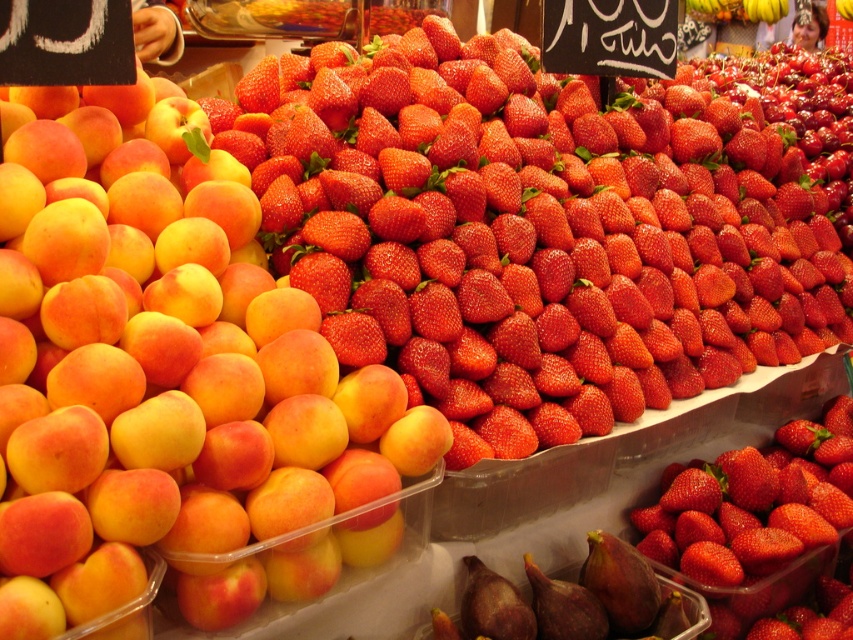
Question: Which object is closer to the camera taking this photo?

Choices:
 (A) matte yellow-orange peach at left
 (B) red matte strawberry at center

Answer: (A)

Question: In this image, where is matte yellow-orange peach at left located relative to red matte strawberry at center?

Choices:
 (A) right
 (B) left

Answer: (B)

Question: Among these objects, which one is nearest to the camera?

Choices:
 (A) red matte strawberry at center
 (B) matte yellow-orange peach at left

Answer: (B)

Question: Does matte yellow-orange peach at left appear on the right side of red matte strawberry at center?

Choices:
 (A) no
 (B) yes

Answer: (A)

Question: Does matte yellow-orange peach at left have a lesser width compared to red matte strawberry at center?

Choices:
 (A) no
 (B) yes

Answer: (A)